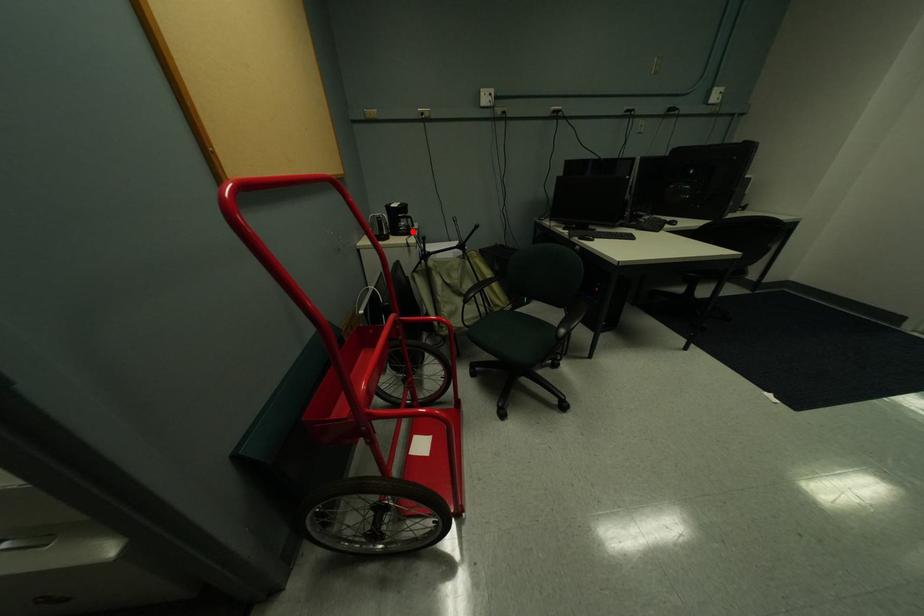
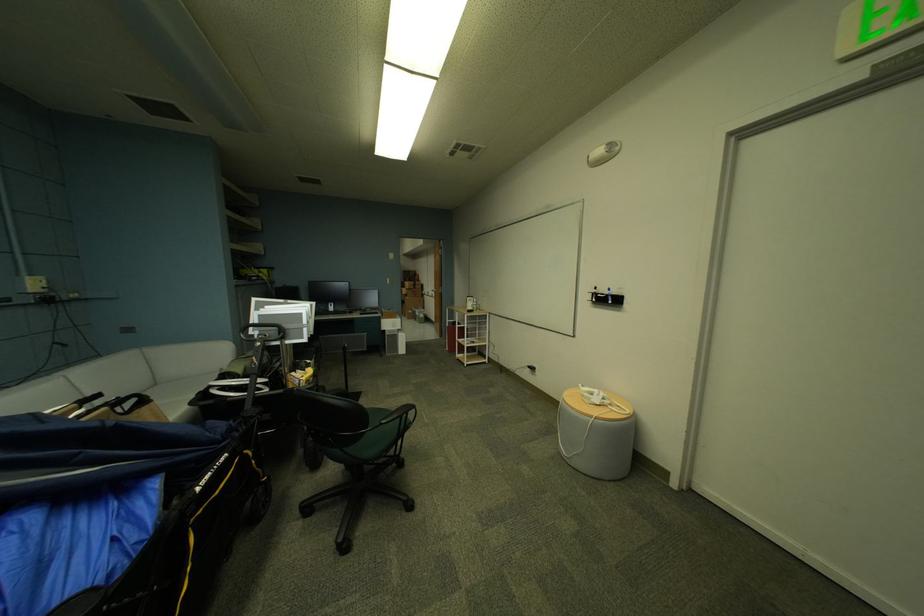
Question: I am providing you with two images of the same scene from different viewpoints. A red point is marked on the first image. Can you still see the location of the red point in image 2?

Choices:
 (A) Yes
 (B) No

Answer: (B)